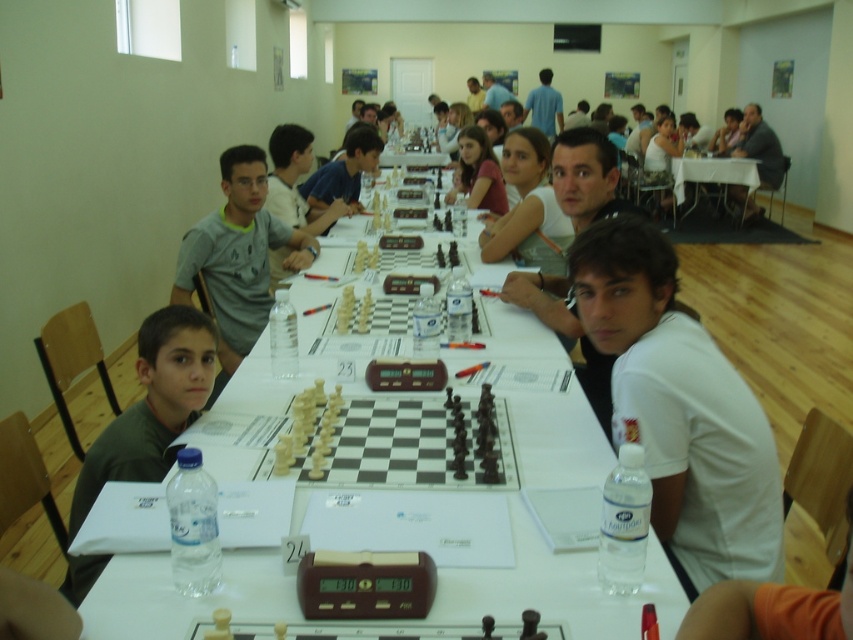
What do you see at coordinates (556, 588) in the screenshot?
I see `white glossy table at center` at bounding box center [556, 588].

Who is positioned more to the left, white glossy table at center or dark gray shirt at center?

white glossy table at center

What do you see at coordinates (556, 588) in the screenshot? I see `white glossy table at center` at bounding box center [556, 588].

The image size is (853, 640). In order to click on white glossy table at center in this screenshot , I will do point(556,588).

Does white plastic chess set at center appear on the right side of white plastic table at center?

No, white plastic chess set at center is not to the right of white plastic table at center.

Between point (427, 404) and point (720, 176), which one is positioned in front?

Point (427, 404) is in front.

This screenshot has width=853, height=640. What do you see at coordinates (408, 444) in the screenshot?
I see `white plastic chess set at center` at bounding box center [408, 444].

Locate an element on the screen. The height and width of the screenshot is (640, 853). white plastic chess set at center is located at coordinates (408, 444).

Is the position of white plastic chess set at center more distant than that of dark green shirt at left?

Yes, white plastic chess set at center is behind dark green shirt at left.

Who is more distant from viewer, (428, 451) or (183, 404)?

Positioned behind is point (183, 404).

Measure the distance between point (x=437, y=442) and camera.

Point (x=437, y=442) is 6.48 feet away from camera.

Identify the location of white plastic chess set at center. (408, 444).